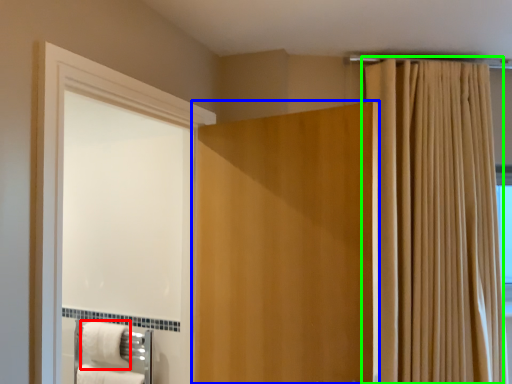
Question: Which object is positioned farthest from bath towel (highlighted by a red box)? Select from door (highlighted by a blue box) and curtain (highlighted by a green box).

Choices:
 (A) door
 (B) curtain

Answer: (B)